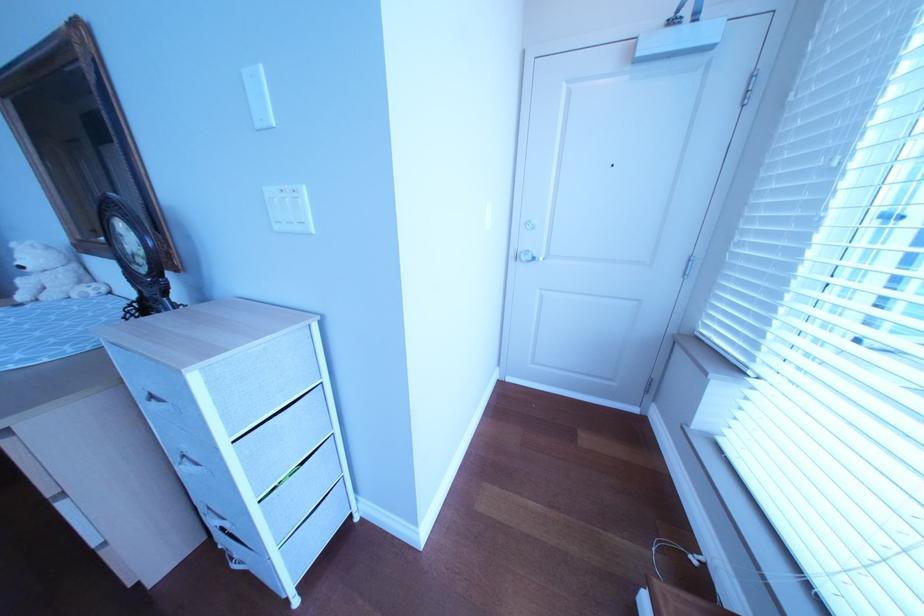
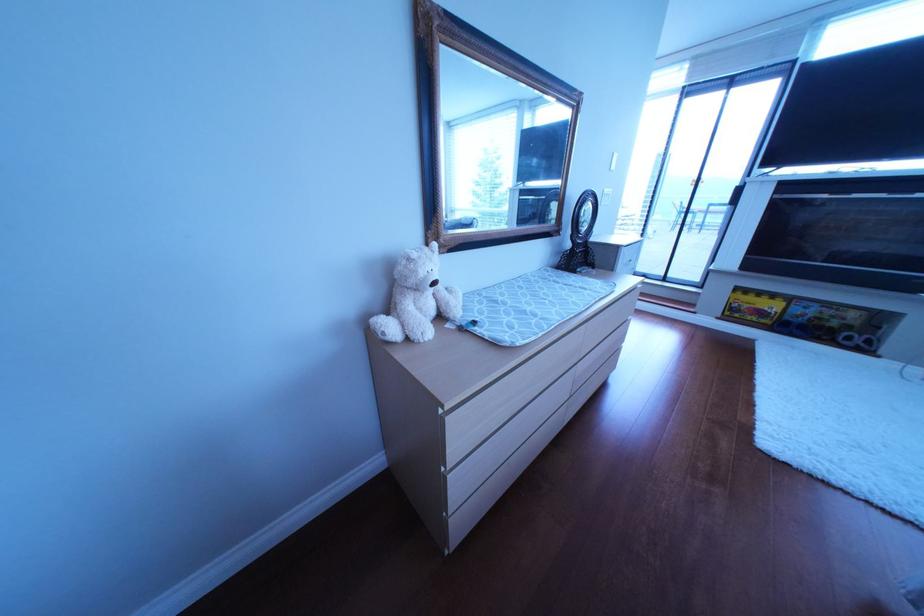
Question: I am providing you with two images of the same scene from different viewpoints. After the viewpoint changes to image2, which objects are now occluded?

Choices:
 (A) blue and gray backpack
 (B) blind adjustment cords
 (C) small black mirror
 (D) yellow toy box

Answer: (B)